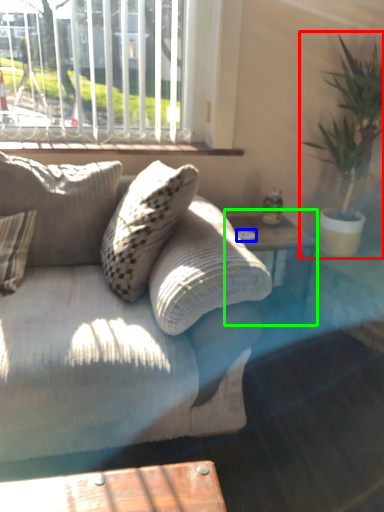
Question: Which object is the farthest from houseplant (highlighted by a red box)? Choose among these: glass plate (highlighted by a blue box) or table (highlighted by a green box).

Choices:
 (A) glass plate
 (B) table

Answer: (A)